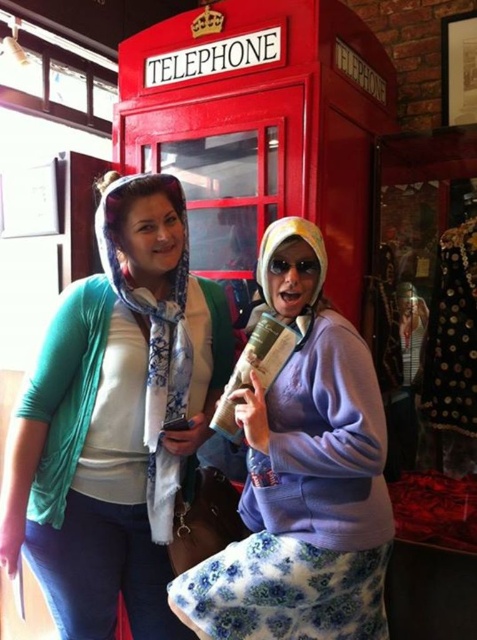
You are trying to decide which item to take with you based on size. You see a matte blue scarf at center and a purple fleece jacket at center. Which one is larger?

The matte blue scarf at center is bigger than the purple fleece jacket at center, so you should take the matte blue scarf at center.

In the scene shown: You are trying to decide which item to take with you for a chilly walk. Both the matte blue scarf at center and the purple fleece jacket at center are visible. Based on their sizes, which one might be more suitable for covering more of your body?

The matte blue scarf at center is wider than the purple fleece jacket at center, so it might be more suitable for covering more of your body due to its greater width.

You are a photographer trying to capture the perfect shot of the telephone booth and the people. You notice a specific point marked at coordinates [116,419]. What object is located at this point?

The point at coordinates [116,419] marks the location of the matte blue scarf at center.